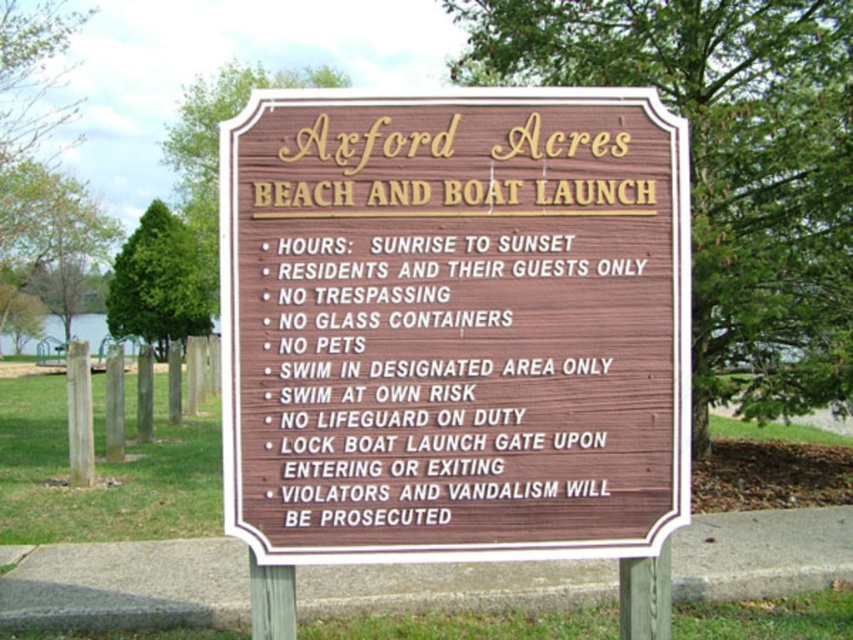
At what (x,y) coordinates should I click in order to perform the action: click on brown wood sign at center. Please return your answer as a coordinate pair (x, y). Looking at the image, I should click on (454, 324).

Is brown wood sign at center smaller than green wood tree at left?

Yes.

Is point (415, 220) farther from viewer compared to point (126, 321)?

No, (415, 220) is closer to viewer.

The width and height of the screenshot is (853, 640). I want to click on brown wood sign at center, so click(x=454, y=324).

Who is lower down, green leafy tree at left or green wood tree at left?

green wood tree at left is lower down.

Between point (74, 205) and point (161, 248), which one is positioned in front?

Positioned in front is point (74, 205).

Locate an element on the screen. green leafy tree at left is located at coordinates (41, 177).

Between green leafy tree at left and green wood tree at upper center, which one is positioned higher?

green leafy tree at left

Is green leafy tree at left below green wood tree at upper center?

Actually, green leafy tree at left is above green wood tree at upper center.

This screenshot has width=853, height=640. Describe the element at coordinates (41, 177) in the screenshot. I see `green leafy tree at left` at that location.

Image resolution: width=853 pixels, height=640 pixels. Identify the location of green leafy tree at left. (41, 177).